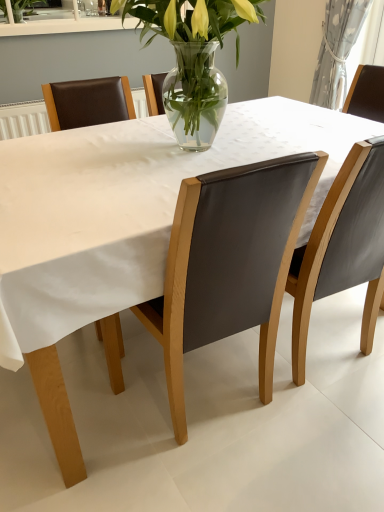
Image resolution: width=384 pixels, height=512 pixels. I want to click on matte gray chair at right, the 1th chair in the right-to-left sequence, so click(343, 248).

Where is `leather at center, positioned as the first chair in left-to-right order`? Image resolution: width=384 pixels, height=512 pixels. leather at center, positioned as the first chair in left-to-right order is located at coordinates (229, 264).

This screenshot has width=384, height=512. I want to click on matte gray chair at right, placed as the second chair when sorted from left to right, so [x=343, y=248].

From the image's perspective, is matte gray chair at right, the 1th chair in the right-to-left sequence, on leather at center, the 2th chair viewed from the right?

Correct, matte gray chair at right, the 1th chair in the right-to-left sequence, appears higher than leather at center, the 2th chair viewed from the right, in the image.

The width and height of the screenshot is (384, 512). Find the location of `chair above the matte gray chair at right, placed as the second chair when sorted from left to right (from a real-world perspective)`. chair above the matte gray chair at right, placed as the second chair when sorted from left to right (from a real-world perspective) is located at coordinates (229, 264).

Which object is closer to the camera taking this photo, matte gray chair at right, placed as the second chair when sorted from left to right, or leather at center, the 2th chair viewed from the right?

leather at center, the 2th chair viewed from the right, is in front.

Does leather at center, the 2th chair viewed from the right, come behind matte gray chair at right, the 1th chair in the right-to-left sequence?

No.

Would you say leather at center, positioned as the first chair in left-to-right order, is inside or outside matte gray chair at right, the 1th chair in the right-to-left sequence?

leather at center, positioned as the first chair in left-to-right order, exists outside the volume of matte gray chair at right, the 1th chair in the right-to-left sequence.

From the image's perspective, is leather at center, positioned as the first chair in left-to-right order, beneath matte gray chair at right, placed as the second chair when sorted from left to right?

Indeed, from the image's perspective, leather at center, positioned as the first chair in left-to-right order, is shown beneath matte gray chair at right, placed as the second chair when sorted from left to right.

At what (x,y) coordinates should I click in order to perform the action: click on curtain that appears above the leather at center, positioned as the first chair in left-to-right order (from a real-world perspective). Please return your answer as a coordinate pair (x, y). Looking at the image, I should click on (337, 50).

Which of these two, leather at center, positioned as the first chair in left-to-right order, or white textured curtain at upper right, is bigger?

leather at center, positioned as the first chair in left-to-right order.

Is leather at center, the 2th chair viewed from the right, not within white textured curtain at upper right?

Yes, leather at center, the 2th chair viewed from the right, is not within white textured curtain at upper right.

This screenshot has height=512, width=384. In order to click on curtain above the leather at center, positioned as the first chair in left-to-right order (from a real-world perspective) in this screenshot , I will do `click(337, 50)`.

Can you confirm if white textured curtain at upper right is smaller than leather at center, the 2th chair viewed from the right?

Indeed, white textured curtain at upper right has a smaller size compared to leather at center, the 2th chair viewed from the right.

From a real-world perspective, is white textured curtain at upper right positioned above or below leather at center, positioned as the first chair in left-to-right order?

white textured curtain at upper right is situated higher than leather at center, positioned as the first chair in left-to-right order, in the real world.

Is white textured curtain at upper right wider than leather at center, the 2th chair viewed from the right?

No, white textured curtain at upper right is not wider than leather at center, the 2th chair viewed from the right.

From the image's perspective, is matte gray chair at right, placed as the second chair when sorted from left to right, positioned above or below white textured curtain at upper right?

Clearly, from the image's perspective, matte gray chair at right, placed as the second chair when sorted from left to right, is below white textured curtain at upper right.

Considering the relative sizes of matte gray chair at right, the 1th chair in the right-to-left sequence, and white textured curtain at upper right in the image provided, is matte gray chair at right, the 1th chair in the right-to-left sequence, smaller than white textured curtain at upper right?

No.

Considering the sizes of matte gray chair at right, placed as the second chair when sorted from left to right, and white textured curtain at upper right in the image, is matte gray chair at right, placed as the second chair when sorted from left to right, taller or shorter than white textured curtain at upper right?

Considering their sizes, matte gray chair at right, placed as the second chair when sorted from left to right, has more height than white textured curtain at upper right.

Does matte gray chair at right, placed as the second chair when sorted from left to right, appear on the left side of white textured curtain at upper right?

Yes.

Is white textured curtain at upper right placed right next to matte gray chair at right, placed as the second chair when sorted from left to right?

No, white textured curtain at upper right is not beside matte gray chair at right, placed as the second chair when sorted from left to right.

Is matte gray chair at right, placed as the second chair when sorted from left to right, located within white textured curtain at upper right?

That's incorrect, matte gray chair at right, placed as the second chair when sorted from left to right, is not inside white textured curtain at upper right.

Considering the positions of objects white textured curtain at upper right and matte gray chair at right, the 1th chair in the right-to-left sequence, in the image provided, who is behind, white textured curtain at upper right or matte gray chair at right, the 1th chair in the right-to-left sequence,?

Positioned behind is white textured curtain at upper right.

The width and height of the screenshot is (384, 512). I want to click on curtain above the matte gray chair at right, placed as the second chair when sorted from left to right (from a real-world perspective), so click(x=337, y=50).

You are a GUI agent. You are given a task and a screenshot of the screen. Output one action in this format:
    pyautogui.click(x=<x>, y=<y>)
    Task: Click on the chair behind the leather at center, the 2th chair viewed from the right
    The image size is (384, 512).
    Given the screenshot: What is the action you would take?
    pyautogui.click(x=343, y=248)

At what (x,y) coordinates should I click in order to perform the action: click on chair above the matte gray chair at right, placed as the second chair when sorted from left to right (from a real-world perspective). Please return your answer as a coordinate pair (x, y). Looking at the image, I should click on (229, 264).

From the image, which object appears to be nearer to matte gray chair at right, placed as the second chair when sorted from left to right, white textured curtain at upper right or leather at center, the 2th chair viewed from the right?

leather at center, the 2th chair viewed from the right, is closer to matte gray chair at right, placed as the second chair when sorted from left to right.

From the image, which object appears to be nearer to matte gray chair at right, the 1th chair in the right-to-left sequence, leather at center, positioned as the first chair in left-to-right order, or white textured curtain at upper right?

leather at center, positioned as the first chair in left-to-right order, is positioned closer to the anchor matte gray chair at right, the 1th chair in the right-to-left sequence.

Considering their positions, is white textured curtain at upper right positioned closer to leather at center, the 2th chair viewed from the right, than matte gray chair at right, the 1th chair in the right-to-left sequence?

Among the two, matte gray chair at right, the 1th chair in the right-to-left sequence, is located nearer to leather at center, the 2th chair viewed from the right.

Considering their positions, is matte gray chair at right, placed as the second chair when sorted from left to right, positioned closer to leather at center, positioned as the first chair in left-to-right order, than white textured curtain at upper right?

The object closer to leather at center, positioned as the first chair in left-to-right order, is matte gray chair at right, placed as the second chair when sorted from left to right.

In the scene shown: When comparing their distances from white textured curtain at upper right, does leather at center, the 2th chair viewed from the right, or matte gray chair at right, the 1th chair in the right-to-left sequence, seem further?

Based on the image, leather at center, the 2th chair viewed from the right, appears to be further to white textured curtain at upper right.

Based on their spatial positions, is matte gray chair at right, the 1th chair in the right-to-left sequence, or leather at center, the 2th chair viewed from the right, further from white textured curtain at upper right?

Based on the image, leather at center, the 2th chair viewed from the right, appears to be further to white textured curtain at upper right.

The image size is (384, 512). Identify the location of chair between white textured curtain at upper right and leather at center, the 2th chair viewed from the right, in the vertical direction. (343, 248).